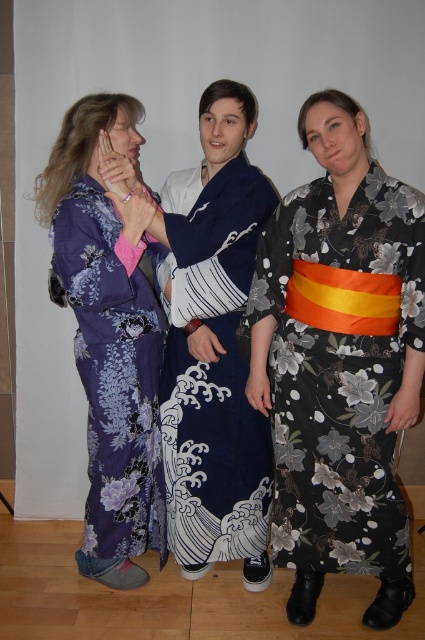
Question: Which point is farther to the camera?

Choices:
 (A) purple floral kimono at left
 (B) navy blue silk kimono at center
 (C) black floral kimono at right

Answer: (B)

Question: Which point is farther to the camera?

Choices:
 (A) purple floral kimono at left
 (B) navy blue silk kimono at center
 (C) black floral kimono at right

Answer: (B)

Question: Is black floral kimono at right positioned before purple floral kimono at left?

Choices:
 (A) no
 (B) yes

Answer: (B)

Question: Among these points, which one is farthest from the camera?

Choices:
 (A) (342, 417)
 (B) (107, 477)
 (C) (164, 429)

Answer: (C)

Question: Is purple floral kimono at left closer to camera compared to navy blue silk kimono at center?

Choices:
 (A) yes
 (B) no

Answer: (A)

Question: Does purple floral kimono at left have a smaller size compared to navy blue silk kimono at center?

Choices:
 (A) no
 (B) yes

Answer: (A)